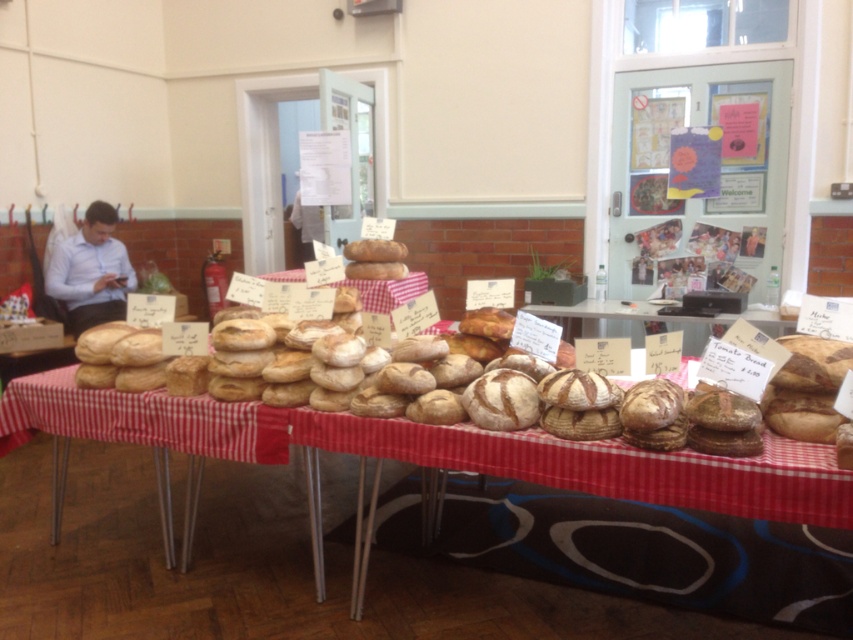
Does matte brown bread at center have a greater height compared to matte blue shirt at left?

No, matte brown bread at center is not taller than matte blue shirt at left.

Can you confirm if matte brown bread at center is wider than matte blue shirt at left?

Yes.

Identify the location of matte brown bread at center. This screenshot has height=640, width=853. (424, 452).

Where is `matte brown bread at center`? This screenshot has height=640, width=853. matte brown bread at center is located at coordinates (424, 452).